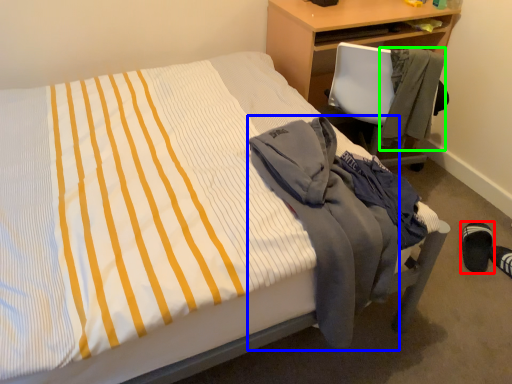
Question: Which is farther away from footwear (highlighted by a red box)? jacket (highlighted by a blue box) or jacket (highlighted by a green box)?

Choices:
 (A) jacket
 (B) jacket

Answer: (A)